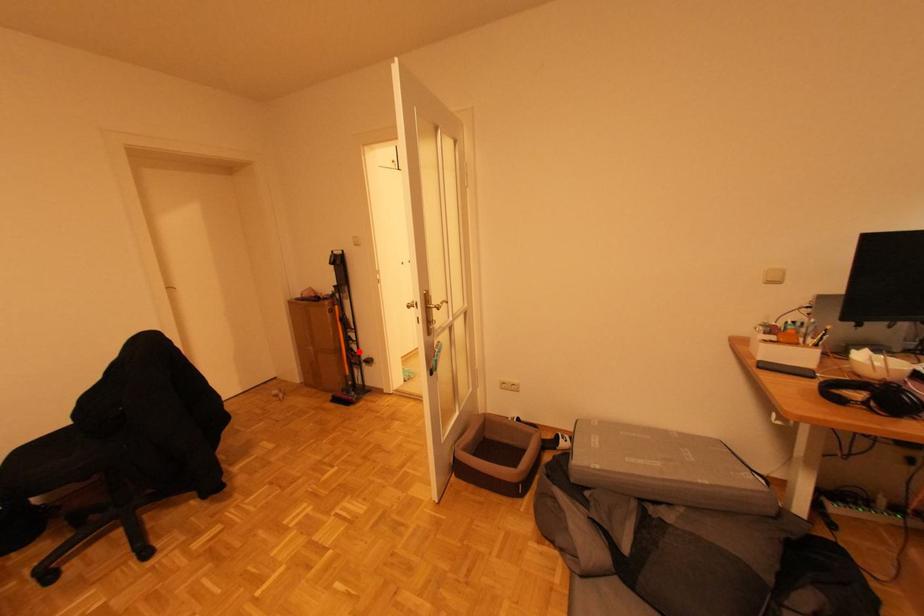
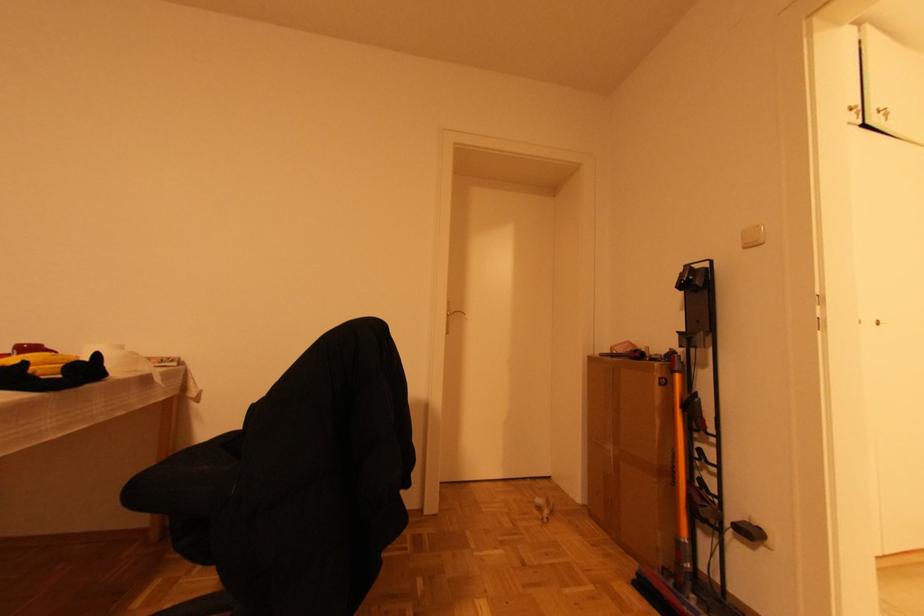
Locate, in the second image, the point that corresponds to the highlighted location in the first image.

(716, 492)